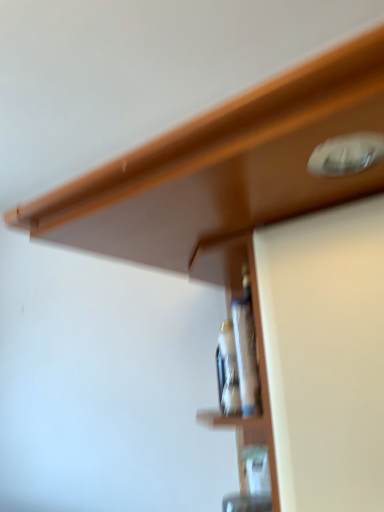
What do you see at coordinates (246, 349) in the screenshot?
I see `translucent glass bottle at center, acting as the second bottle starting from the back` at bounding box center [246, 349].

Image resolution: width=384 pixels, height=512 pixels. Identify the location of translucent glass bottle at center, acting as the second bottle starting from the back. (246, 349).

What are the coordinates of `translucent glass bottle at center, the 2th bottle when ordered from front to back` in the screenshot? It's located at (227, 371).

Describe the element at coordinates (227, 371) in the screenshot. I see `translucent glass bottle at center, the 2th bottle when ordered from front to back` at that location.

In order to face translucent glass bottle at center, the 2th bottle when ordered from front to back, should I rotate leftwards or rightwards?

To face it directly, rotate right by 5.195 degrees.

This screenshot has height=512, width=384. I want to click on translucent glass bottle at center, acting as the second bottle starting from the back, so click(246, 349).

Is translucent glass bottle at center, the 1th bottle viewed from the back, at the left side of translucent glass bottle at center, acting as the second bottle starting from the back?

In fact, translucent glass bottle at center, the 1th bottle viewed from the back, is to the right of translucent glass bottle at center, acting as the second bottle starting from the back.

Does translucent glass bottle at center, the 2th bottle when ordered from front to back, lie behind translucent glass bottle at center, the first bottle when ordered from front to back?

Yes, translucent glass bottle at center, the 2th bottle when ordered from front to back, is further from the camera.

Considering the points (236, 384) and (248, 358), which point is behind, point (236, 384) or point (248, 358)?

The point (236, 384) is more distant.

From the image's perspective, between translucent glass bottle at center, the 2th bottle when ordered from front to back, and translucent glass bottle at center, the first bottle when ordered from front to back, which one is located above?

translucent glass bottle at center, the first bottle when ordered from front to back, appears higher in the image.

From a real-world perspective, which object rests below the other?

translucent glass bottle at center, the 1th bottle viewed from the back.

Considering the sizes of objects translucent glass bottle at center, the 2th bottle when ordered from front to back, and translucent glass bottle at center, the first bottle when ordered from front to back, in the image provided, who is wider, translucent glass bottle at center, the 2th bottle when ordered from front to back, or translucent glass bottle at center, the first bottle when ordered from front to back,?

Wider between the two is translucent glass bottle at center, the 2th bottle when ordered from front to back.

Considering the relative sizes of translucent glass bottle at center, the 1th bottle viewed from the back, and translucent glass bottle at center, acting as the second bottle starting from the back, in the image provided, is translucent glass bottle at center, the 1th bottle viewed from the back, shorter than translucent glass bottle at center, acting as the second bottle starting from the back,?

Indeed, translucent glass bottle at center, the 1th bottle viewed from the back, has a lesser height compared to translucent glass bottle at center, acting as the second bottle starting from the back.

Looking at the image, does translucent glass bottle at center, the 1th bottle viewed from the back, seem bigger or smaller compared to translucent glass bottle at center, the first bottle when ordered from front to back?

translucent glass bottle at center, the 1th bottle viewed from the back, is bigger than translucent glass bottle at center, the first bottle when ordered from front to back.

Is translucent glass bottle at center, acting as the second bottle starting from the back, completely or partially inside translucent glass bottle at center, the 2th bottle when ordered from front to back?

No.

Is there a large distance between translucent glass bottle at center, the 1th bottle viewed from the back, and translucent glass bottle at center, the first bottle when ordered from front to back?

No.

Is translucent glass bottle at center, the 2th bottle when ordered from front to back, looking in the opposite direction of translucent glass bottle at center, acting as the second bottle starting from the back?

No, translucent glass bottle at center, the 2th bottle when ordered from front to back, is not facing the opposite direction of translucent glass bottle at center, acting as the second bottle starting from the back.

From the picture: Can you tell me how much translucent glass bottle at center, the 2th bottle when ordered from front to back, and translucent glass bottle at center, the first bottle when ordered from front to back, differ in facing direction?

The angle between the facing direction of translucent glass bottle at center, the 2th bottle when ordered from front to back, and the facing direction of translucent glass bottle at center, the first bottle when ordered from front to back, is 0.000718 degrees.

What are the coordinates of `bottle behind the translucent glass bottle at center, acting as the second bottle starting from the back` in the screenshot? It's located at (227, 371).

Which is more to the left, translucent glass bottle at center, the first bottle when ordered from front to back, or translucent glass bottle at center, the 2th bottle when ordered from front to back?

From the viewer's perspective, translucent glass bottle at center, the first bottle when ordered from front to back, appears more on the left side.

Is the depth of translucent glass bottle at center, acting as the second bottle starting from the back, greater than that of translucent glass bottle at center, the 1th bottle viewed from the back?

No, translucent glass bottle at center, acting as the second bottle starting from the back, is in front of translucent glass bottle at center, the 1th bottle viewed from the back.

Does point (235, 320) come behind point (236, 369)?

Yes, point (235, 320) is behind point (236, 369).

From the image's perspective, is translucent glass bottle at center, the first bottle when ordered from front to back, on top of translucent glass bottle at center, the 2th bottle when ordered from front to back?

Indeed, from the image's perspective, translucent glass bottle at center, the first bottle when ordered from front to back, is shown above translucent glass bottle at center, the 2th bottle when ordered from front to back.

From a real-world perspective, is translucent glass bottle at center, the first bottle when ordered from front to back, physically below translucent glass bottle at center, the 2th bottle when ordered from front to back?

No, from a real-world perspective, translucent glass bottle at center, the first bottle when ordered from front to back, is not beneath translucent glass bottle at center, the 2th bottle when ordered from front to back.

In terms of width, does translucent glass bottle at center, acting as the second bottle starting from the back, look wider or thinner when compared to translucent glass bottle at center, the 2th bottle when ordered from front to back?

translucent glass bottle at center, acting as the second bottle starting from the back, is thinner than translucent glass bottle at center, the 2th bottle when ordered from front to back.

Is translucent glass bottle at center, the first bottle when ordered from front to back, taller or shorter than translucent glass bottle at center, the 1th bottle viewed from the back?

In the image, translucent glass bottle at center, the first bottle when ordered from front to back, appears to be taller than translucent glass bottle at center, the 1th bottle viewed from the back.

Considering the relative sizes of translucent glass bottle at center, acting as the second bottle starting from the back, and translucent glass bottle at center, the 1th bottle viewed from the back, in the image provided, is translucent glass bottle at center, acting as the second bottle starting from the back, bigger than translucent glass bottle at center, the 1th bottle viewed from the back,?

Actually, translucent glass bottle at center, acting as the second bottle starting from the back, might be smaller than translucent glass bottle at center, the 1th bottle viewed from the back.

Could translucent glass bottle at center, the 2th bottle when ordered from front to back, be considered to be inside translucent glass bottle at center, acting as the second bottle starting from the back?

No, translucent glass bottle at center, the 2th bottle when ordered from front to back, is not inside translucent glass bottle at center, acting as the second bottle starting from the back.

Is translucent glass bottle at center, acting as the second bottle starting from the back, not near translucent glass bottle at center, the 1th bottle viewed from the back?

No, translucent glass bottle at center, acting as the second bottle starting from the back, is not far from translucent glass bottle at center, the 1th bottle viewed from the back.

Is translucent glass bottle at center, acting as the second bottle starting from the back, facing towards translucent glass bottle at center, the 2th bottle when ordered from front to back?

No, translucent glass bottle at center, acting as the second bottle starting from the back, is not aimed at translucent glass bottle at center, the 2th bottle when ordered from front to back.

The width and height of the screenshot is (384, 512). I want to click on bottle on the left side of translucent glass bottle at center, the 2th bottle when ordered from front to back, so click(x=246, y=349).

Find the location of a particular element. bottle that is above the translucent glass bottle at center, the 1th bottle viewed from the back (from a real-world perspective) is located at coordinates (246, 349).

At what (x,y) coordinates should I click in order to perform the action: click on bottle in front of the translucent glass bottle at center, the 1th bottle viewed from the back. Please return your answer as a coordinate pair (x, y). Looking at the image, I should click on (x=246, y=349).